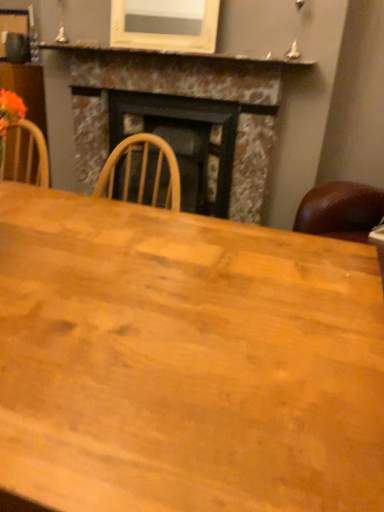
At what (x,y) coordinates should I click in order to perform the action: click on wooden table at center. Please return your answer as a coordinate pair (x, y). Looking at the image, I should click on (185, 361).

At what (x,y) coordinates should I click in order to perform the action: click on marble fireplace at center. Please return your answer as a coordinate pair (x, y). Looking at the image, I should click on (179, 74).

How far apart are marble mantel at upper center and marble fireplace at center?

marble mantel at upper center is 10.98 inches from marble fireplace at center.

Considering the sizes of marble mantel at upper center and marble fireplace at center in the image, is marble mantel at upper center taller or shorter than marble fireplace at center?

Considering their sizes, marble mantel at upper center has less height than marble fireplace at center.

Which is more to the right, marble mantel at upper center or marble fireplace at center?

marble fireplace at center is more to the right.

How different are the orientations of wooden table at center and marble fireplace at center in degrees?

The angular difference between wooden table at center and marble fireplace at center is 91.1 degrees.

Is wooden table at center oriented towards marble fireplace at center?

No, wooden table at center is not aimed at marble fireplace at center.

Considering the relative sizes of wooden table at center and marble fireplace at center in the image provided, is wooden table at center taller than marble fireplace at center?

No, wooden table at center is not taller than marble fireplace at center.

From the image's perspective, does wooden table at center appear higher than marble mantel at upper center?

No, from the image's perspective, wooden table at center is not over marble mantel at upper center.

Consider the image. Who is more distant, wooden table at center or marble mantel at upper center?

marble mantel at upper center is further away from the camera.

Is wooden table at center to the left or to the right of marble mantel at upper center in the image?

wooden table at center is to the right of marble mantel at upper center.

Considering the points (169, 82) and (383, 394), which point is behind, point (169, 82) or point (383, 394)?

Positioned behind is point (169, 82).

Can you confirm if marble fireplace at center is positioned to the right of wooden table at center?

No, marble fireplace at center is not to the right of wooden table at center.

How far apart are marble fireplace at center and wooden table at center?

A distance of 6.09 feet exists between marble fireplace at center and wooden table at center.

Between marble fireplace at center and marble mantel at upper center, which one appears on the left side from the viewer's perspective?

marble mantel at upper center is more to the left.

Is marble fireplace at center with marble mantel at upper center?

No, marble fireplace at center is not next to marble mantel at upper center.

From a real-world perspective, who is located higher, marble fireplace at center or marble mantel at upper center?

marble mantel at upper center, from a real-world perspective.

Can you confirm if marble mantel at upper center is smaller than wooden table at center?

Yes, marble mantel at upper center is smaller than wooden table at center.

How distant is marble mantel at upper center from wooden table at center?

marble mantel at upper center and wooden table at center are 1.93 meters apart from each other.

Considering the sizes of objects marble mantel at upper center and wooden table at center in the image provided, who is wider, marble mantel at upper center or wooden table at center?

Wider between the two is wooden table at center.

Is marble mantel at upper center aimed at wooden table at center?

No, marble mantel at upper center is not turned towards wooden table at center.

This screenshot has width=384, height=512. In order to click on mantle on the left of the marble fireplace at center in this screenshot , I will do `click(173, 55)`.

In the image, there is a wooden table at center. Where is `fireplace above it (from the image's perspective)`? Image resolution: width=384 pixels, height=512 pixels. fireplace above it (from the image's perspective) is located at coordinates (179, 74).

Estimate the real-world distances between objects in this image. Which object is closer to marble mantel at upper center, marble fireplace at center or wooden table at center?

The object closer to marble mantel at upper center is marble fireplace at center.

Which object lies further to the anchor point wooden table at center, marble mantel at upper center or marble fireplace at center?

Based on the image, marble mantel at upper center appears to be further to wooden table at center.

From the image, which object appears to be farther from marble mantel at upper center, wooden table at center or marble fireplace at center?

wooden table at center is positioned further to the anchor marble mantel at upper center.

Considering their positions, is wooden table at center positioned closer to marble fireplace at center than marble mantel at upper center?

marble mantel at upper center lies closer to marble fireplace at center than the other object.

Considering their positions, is marble mantel at upper center positioned further to marble fireplace at center than wooden table at center?

Among the two, wooden table at center is located further to marble fireplace at center.

Which object lies further to the anchor point wooden table at center, marble fireplace at center or marble mantel at upper center?

Among the two, marble mantel at upper center is located further to wooden table at center.

Locate an element on the screen. The image size is (384, 512). mantle between wooden table at center and marble fireplace at center from front to back is located at coordinates (173, 55).